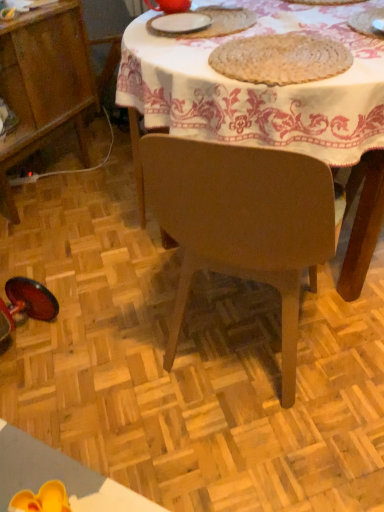
Where is `vacant space in front of wooden cabinet at lower left`? vacant space in front of wooden cabinet at lower left is located at coordinates (63, 249).